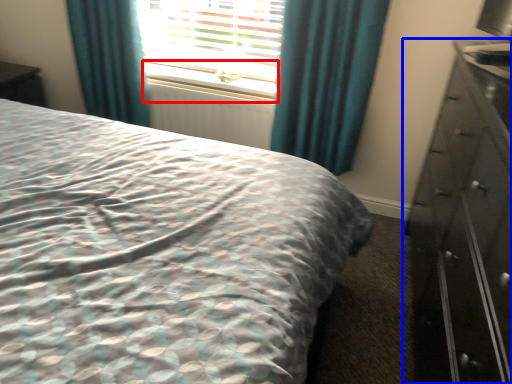
Question: Which point is closer to the camera, window sill (highlighted by a red box) or chest of drawers (highlighted by a blue box)?

Choices:
 (A) window sill
 (B) chest of drawers

Answer: (B)